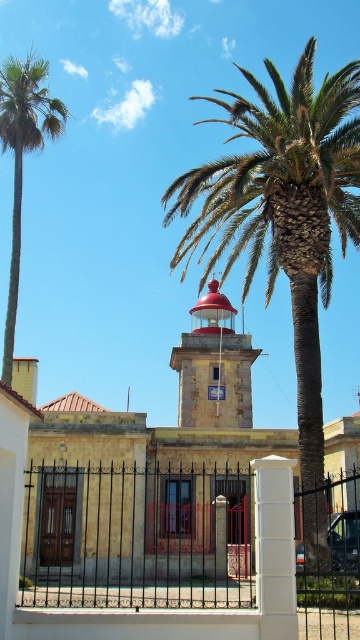
You are a visitor approaching the lighthouse compound and notice the red painted metal bell tower at center and the green leafy palm at left. Which object takes up more space in the scene?

The green leafy palm at left takes up more space in the scene than the red painted metal bell tower at center, as the bell tower occupies less space according to the description.